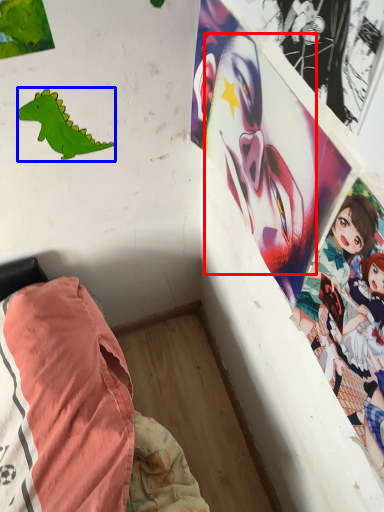
Question: Which point is closer to the camera, human face (highlighted by a red box) or dinosaur (highlighted by a blue box)?

Choices:
 (A) human face
 (B) dinosaur

Answer: (A)